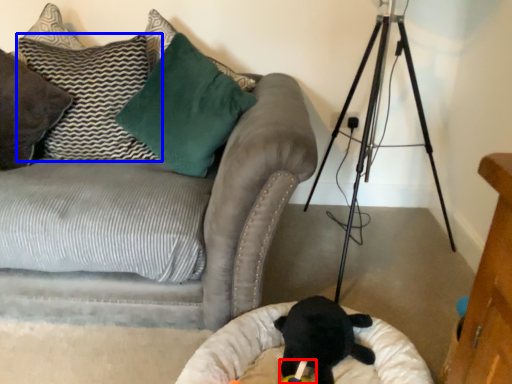
Question: Which of the following is the farthest to the observer, toy (highlighted by a red box) or pillow (highlighted by a blue box)?

Choices:
 (A) toy
 (B) pillow

Answer: (B)